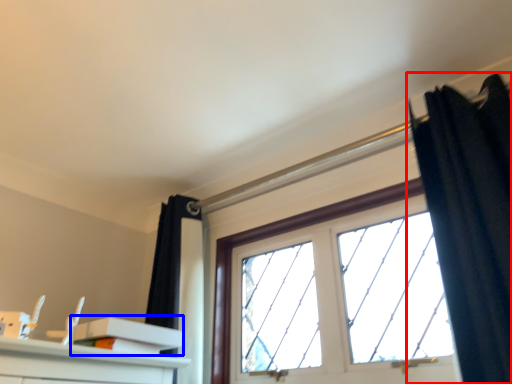
Question: Which point is further to the camera, curtain (highlighted by a red box) or shelf (highlighted by a blue box)?

Choices:
 (A) curtain
 (B) shelf

Answer: (B)